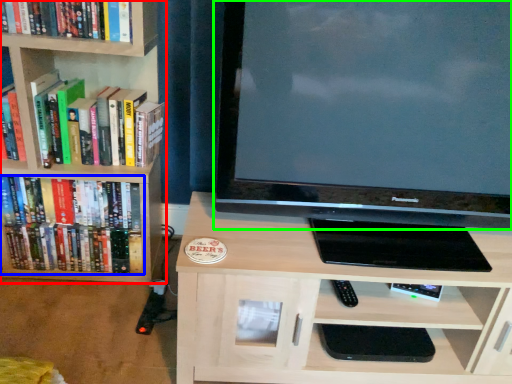
Question: Estimate the real-world distances between objects in this image. Which object is closer to bookcase (highlighted by a red box), book (highlighted by a blue box) or television (highlighted by a green box)?

Choices:
 (A) book
 (B) television

Answer: (A)